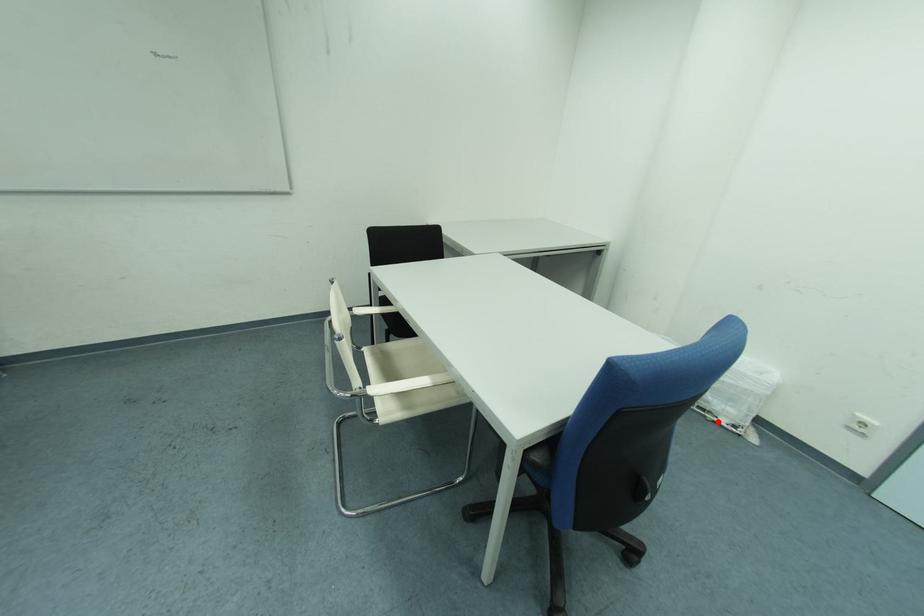
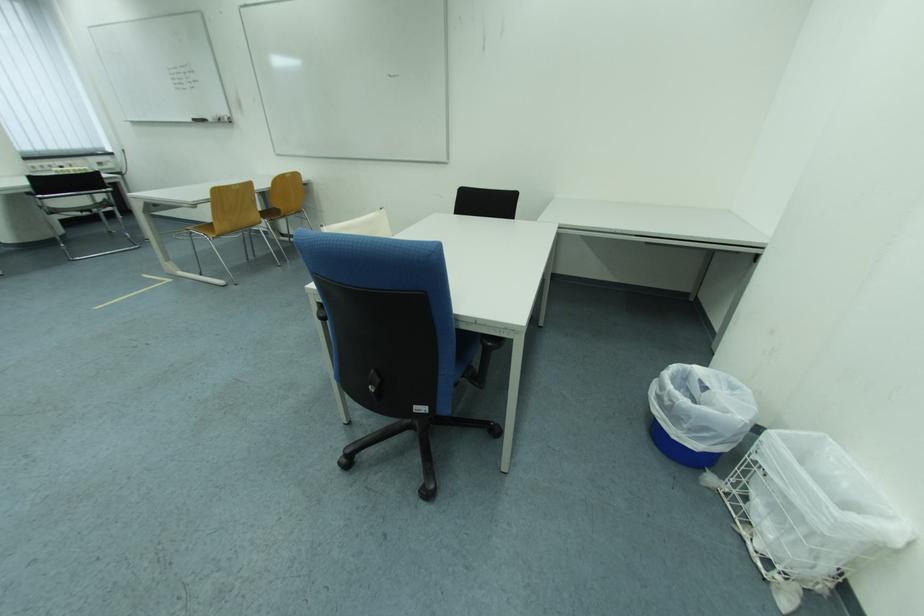
Question: I am providing you with two images of the same scene from different viewpoints. In image1, a red point is highlighted. Considering the same 3D point in image2, which of the following is correct?

Choices:
 (A) It is closer
 (B) It is farther

Answer: (B)